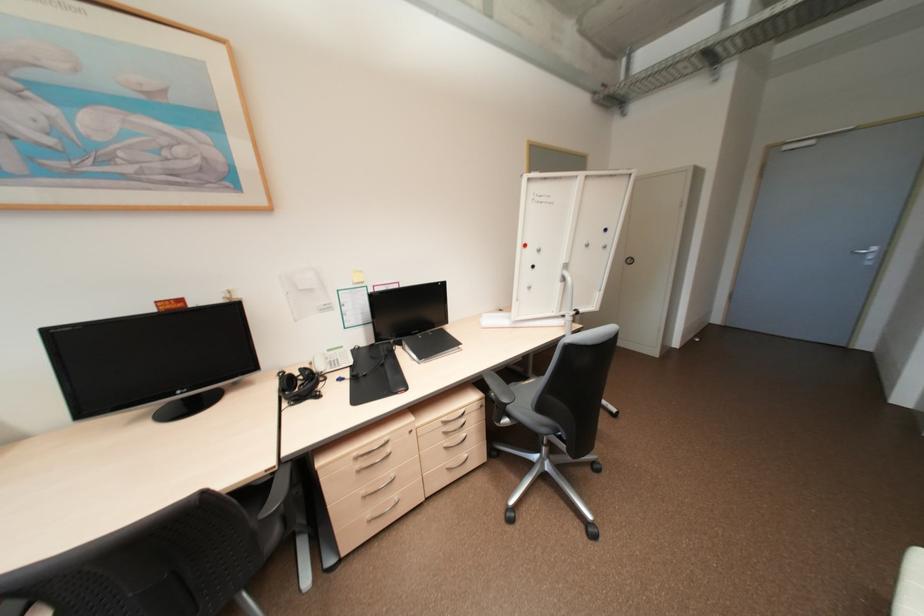
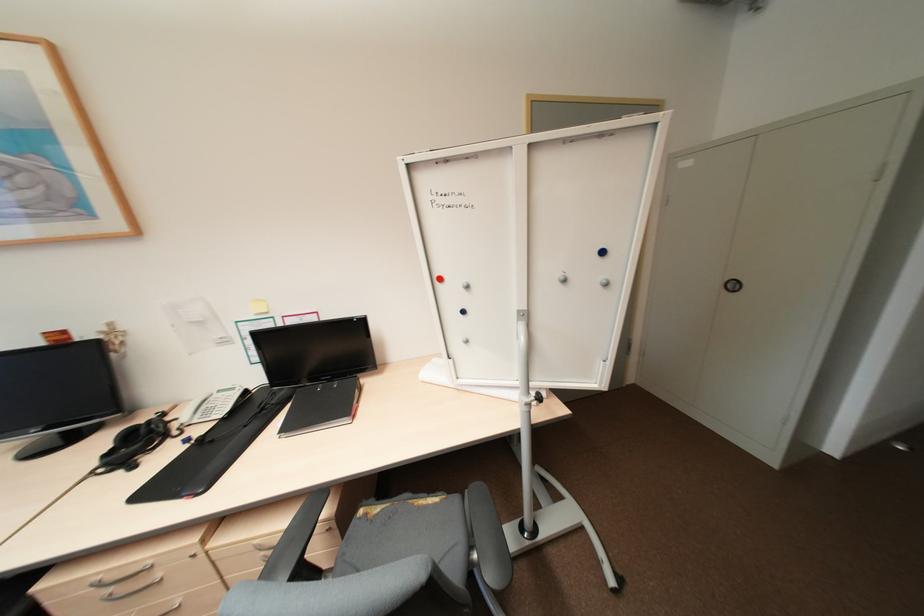
Where in the second image is the point corresponding to the point at 361,458 from the first image?

(104, 584)